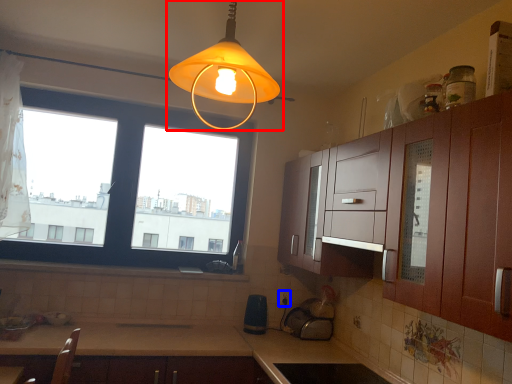
Question: Which point is closer to the camera, lamp (highlighted by a red box) or electric outlet (highlighted by a blue box)?

Choices:
 (A) lamp
 (B) electric outlet

Answer: (A)